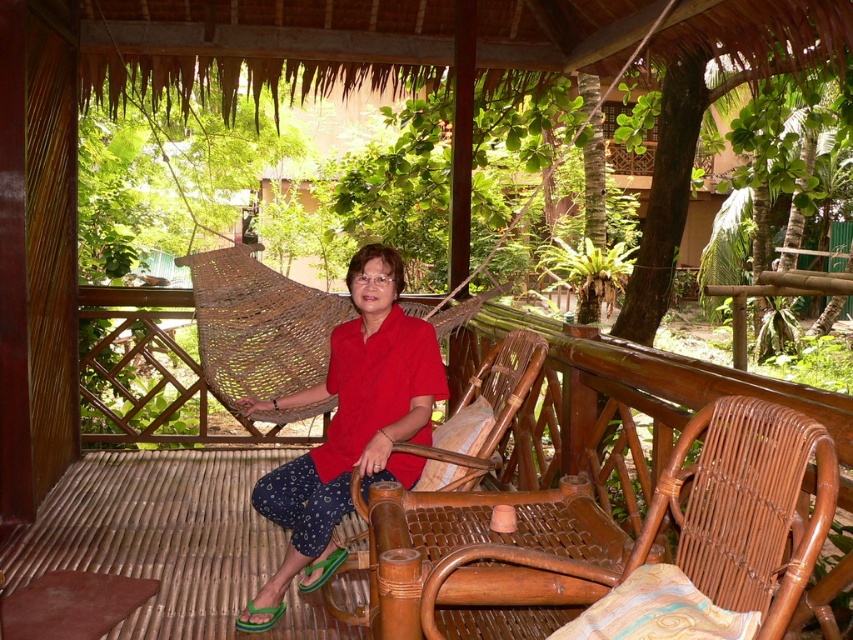
Question: Among these objects, which one is nearest to the camera?

Choices:
 (A) woven bamboo chair at center
 (B) brown wicker rocking chair at center
 (C) red matte shirt at center

Answer: (B)

Question: Does red matte shirt at center have a larger size compared to woven bamboo chair at center?

Choices:
 (A) yes
 (B) no

Answer: (A)

Question: Which of the following is the farthest from the observer?

Choices:
 (A) woven bamboo chair at center
 (B) red matte shirt at center
 (C) brown wicker rocking chair at center

Answer: (B)

Question: Is red matte shirt at center wider than woven bamboo chair at center?

Choices:
 (A) no
 (B) yes

Answer: (B)

Question: Which of the following is the closest to the observer?

Choices:
 (A) (323, 380)
 (B) (488, 390)

Answer: (B)

Question: Does red matte shirt at center appear over woven bamboo chair at center?

Choices:
 (A) yes
 (B) no

Answer: (B)